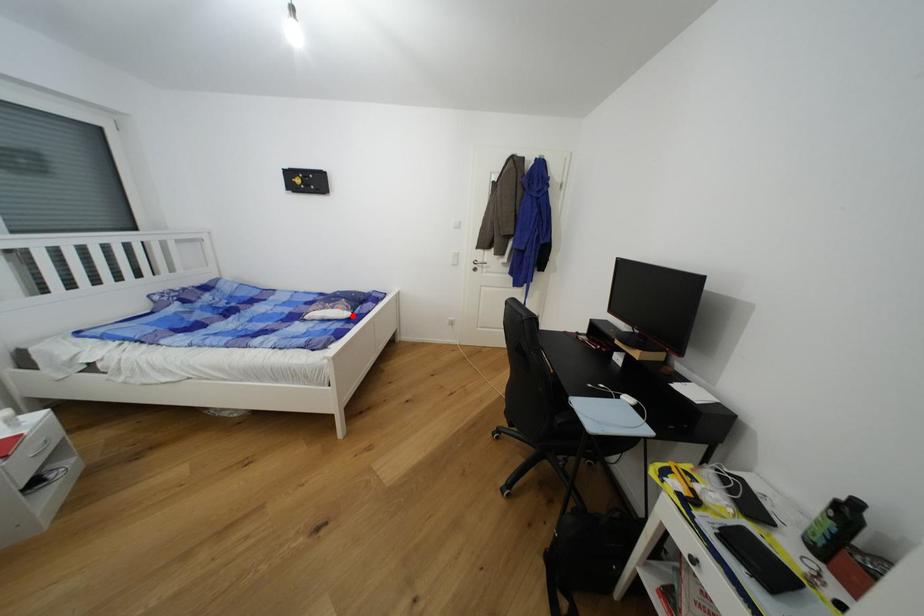
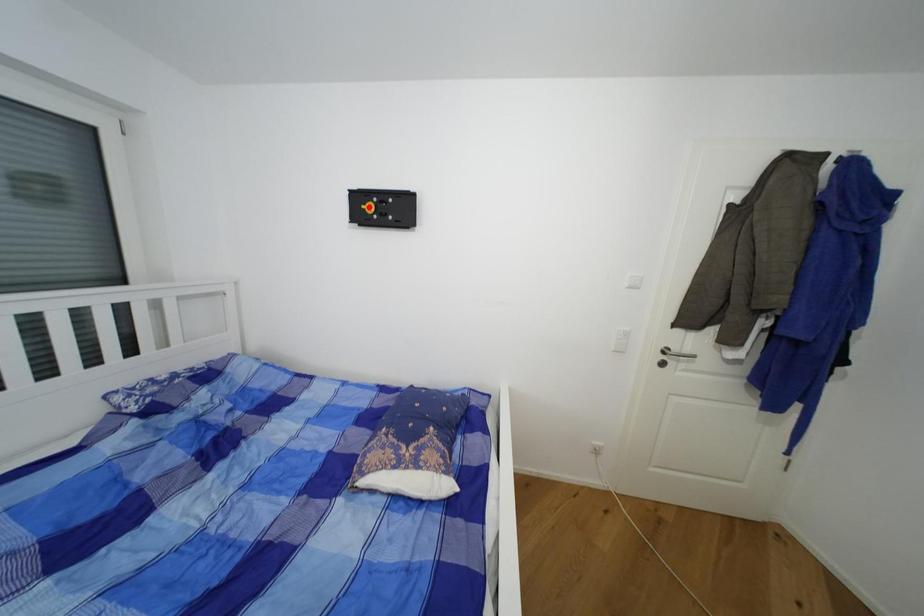
I am providing you with two images of the same scene from different viewpoints. A red point is marked on the first image and another point is marked on the second image. Does the point marked in image1 correspond to the same location as the one in image2?

No